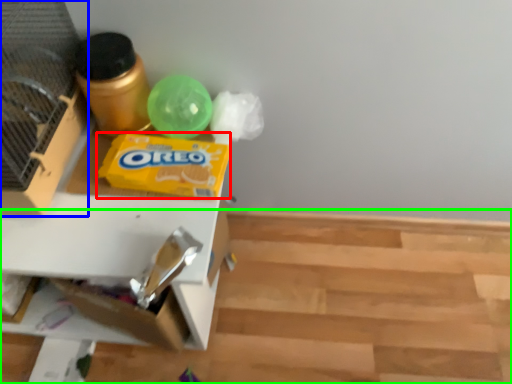
Question: Based on their relative distances, which object is farther from waste (highlighted by a red box)? Choose from bird cage (highlighted by a blue box) and wood (highlighted by a green box).

Choices:
 (A) bird cage
 (B) wood

Answer: (B)